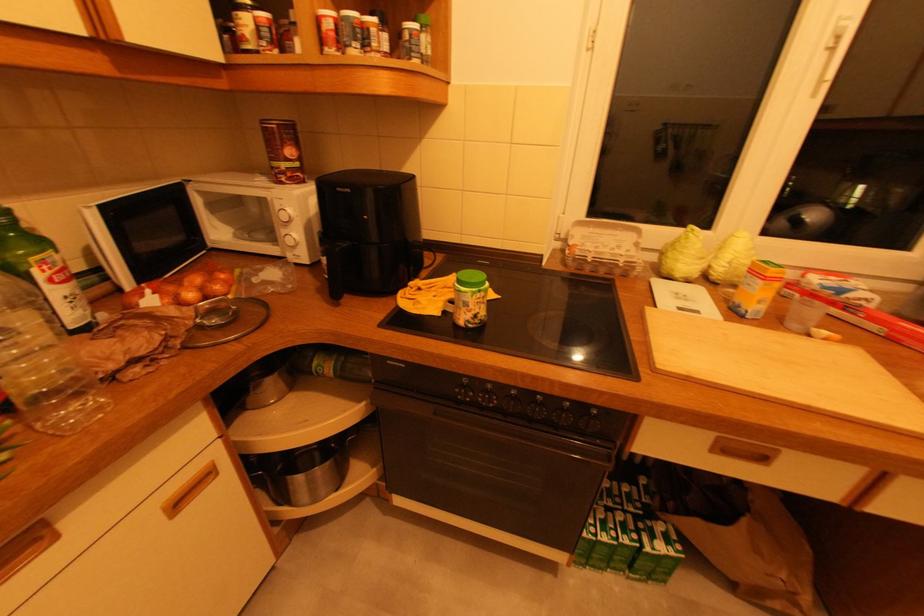
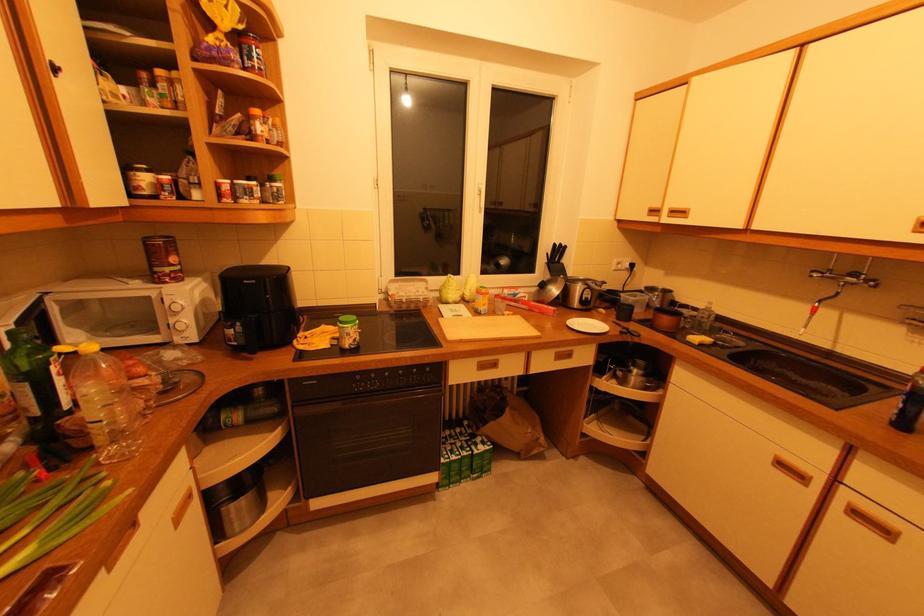
In the second image, find the point that corresponds to point (38, 272) in the first image.

(55, 368)